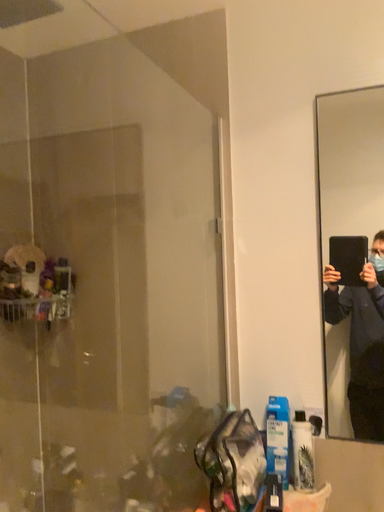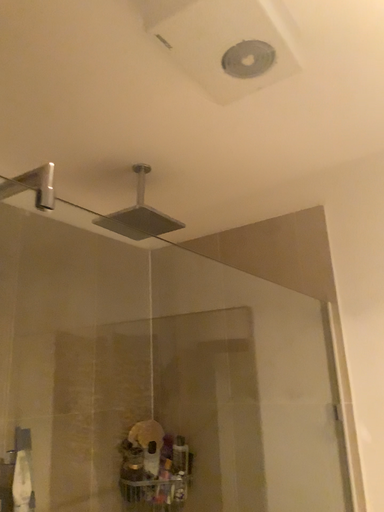
Question: Which way did the camera rotate in the video?

Choices:
 (A) rotated downward
 (B) rotated upward

Answer: (B)